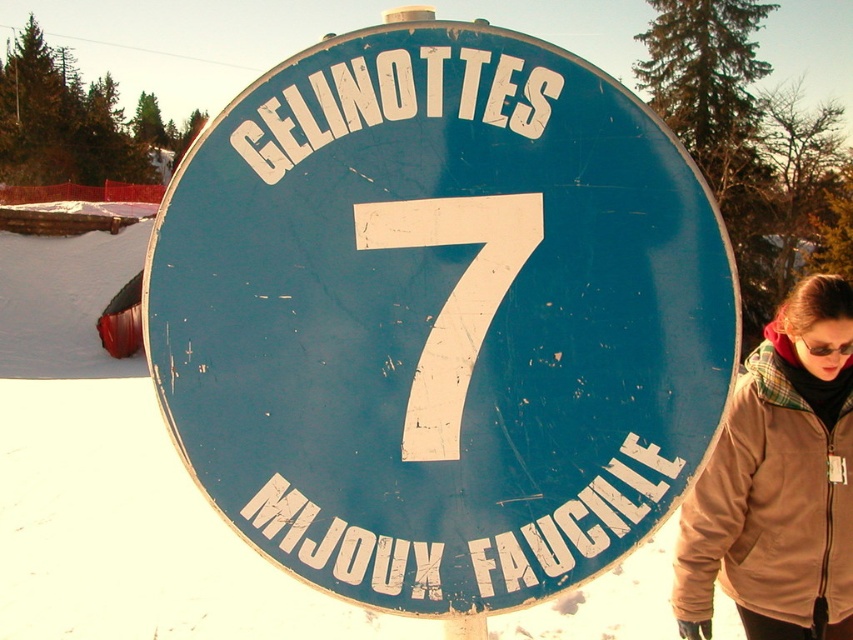
You are standing in front of a weathered circular sign with the word GELINOTTES at the top and the number 7 in the center. There is a point marked at coordinates (x=804, y=605) on the sign. If you want to touch this point with a stick that is 3 meters long, will the stick be long enough?

The point marked at coordinates (x=804, y=605) is 3.41 meters away from you. Since the stick is only 3 meters long, it is not long enough to reach the point.

Consider the image. You are standing in front of the blue matte sign at center and the brown fleece jacket at lower right. Which object is closer to you?

The blue matte sign at center is closer to you because it is positioned over the brown fleece jacket at lower right.